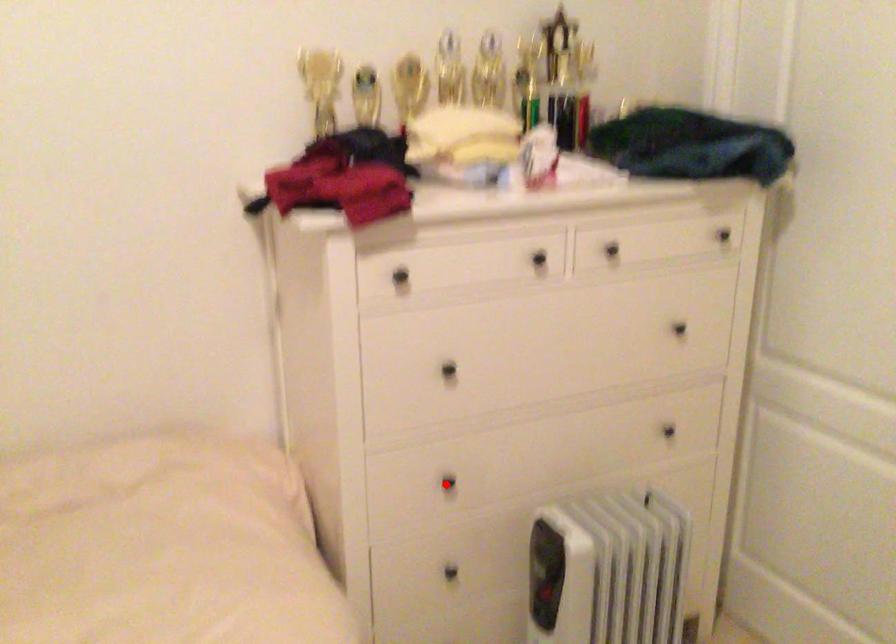
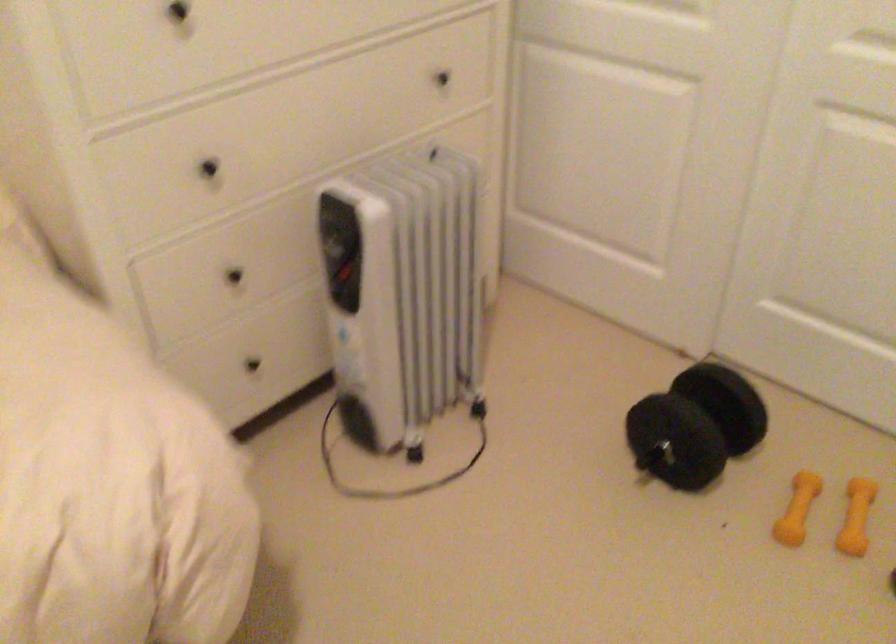
In the second image, find the point that corresponds to the highlighted location in the first image.

(209, 167)